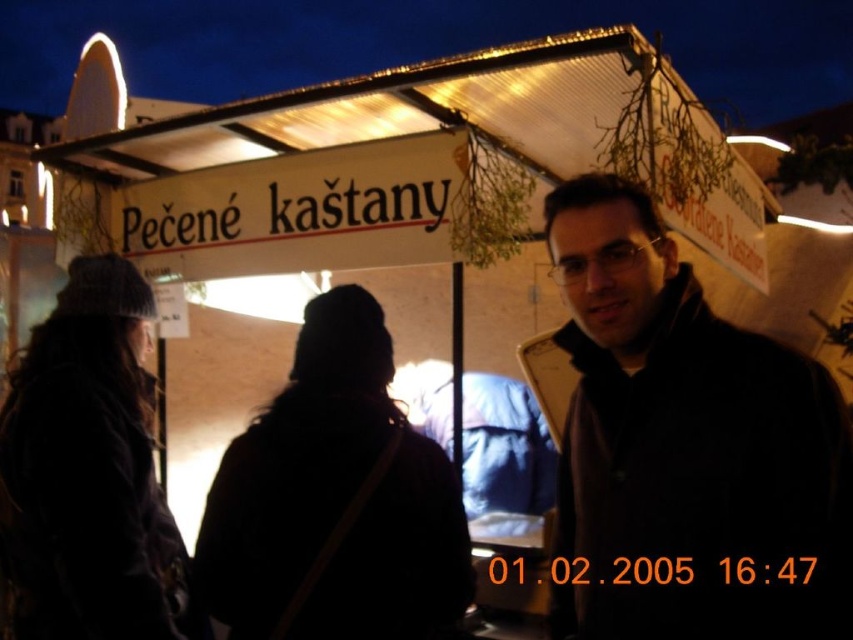
Question: Estimate the real-world distances between objects in this image. Which object is farther from the black matte jacket at center?

Choices:
 (A) black woolen hat at center
 (B) knitted wool hat at left

Answer: (B)

Question: Does black woolen hat at center appear over knitted wool hat at left?

Choices:
 (A) yes
 (B) no

Answer: (A)

Question: Does black matte jacket at center have a smaller size compared to knitted wool hat at left?

Choices:
 (A) yes
 (B) no

Answer: (A)

Question: Does black matte jacket at center have a smaller size compared to black woolen hat at center?

Choices:
 (A) no
 (B) yes

Answer: (A)

Question: Which of the following is the closest to the observer?

Choices:
 (A) (811, 426)
 (B) (369, 436)
 (C) (114, 272)

Answer: (A)

Question: Which object appears closest to the camera in this image?

Choices:
 (A) knitted wool hat at left
 (B) black woolen hat at center

Answer: (B)